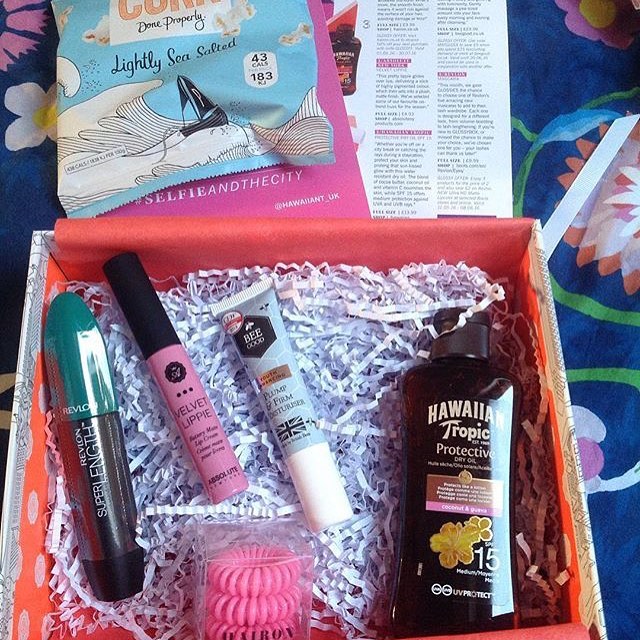
The image size is (640, 640). Find the location of `book`. book is located at coordinates (242, 198).